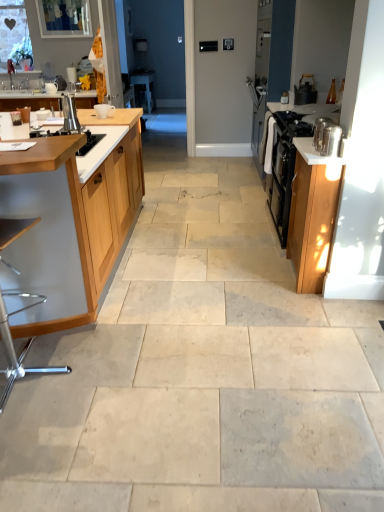
Question: Is white glossy table at center taller than metallic silver containers at right?

Choices:
 (A) yes
 (B) no

Answer: (A)

Question: Is white glossy table at center closer to camera compared to metallic silver containers at right?

Choices:
 (A) yes
 (B) no

Answer: (B)

Question: From a real-world perspective, is white glossy table at center located beneath metallic silver containers at right?

Choices:
 (A) yes
 (B) no

Answer: (A)

Question: Does white glossy table at center contain metallic silver containers at right?

Choices:
 (A) no
 (B) yes

Answer: (A)

Question: Is white glossy table at center beside metallic silver containers at right?

Choices:
 (A) no
 (B) yes

Answer: (A)

Question: From a real-world perspective, relative to wooden cabinet at left, which appears as the 1th cabinetry when viewed from the left, is matte silver sink at left vertically above or below?

Choices:
 (A) above
 (B) below

Answer: (A)

Question: In terms of size, does matte silver sink at left appear bigger or smaller than wooden cabinet at left, the second cabinetry viewed from the right?

Choices:
 (A) big
 (B) small

Answer: (B)

Question: From the image's perspective, is matte silver sink at left positioned above or below wooden cabinet at left, the second cabinetry viewed from the right?

Choices:
 (A) above
 (B) below

Answer: (A)

Question: Considering their positions, is matte silver sink at left located in front of or behind wooden cabinet at left, the second cabinetry viewed from the right?

Choices:
 (A) front
 (B) behind

Answer: (B)

Question: Is metallic silver canister at right, acting as the 1th appliance starting from the front, wider or thinner than matte silver sink at left?

Choices:
 (A) wide
 (B) thin

Answer: (B)

Question: Is point (327, 117) positioned closer to the camera than point (29, 70)?

Choices:
 (A) closer
 (B) farther

Answer: (A)

Question: Is metallic silver canister at right, which is counted as the first appliance, starting from the right, situated inside matte silver sink at left or outside?

Choices:
 (A) outside
 (B) inside

Answer: (A)

Question: Visually, is metallic silver canister at right, marked as the second appliance in a top-to-bottom arrangement, positioned to the left or to the right of matte silver sink at left?

Choices:
 (A) left
 (B) right

Answer: (B)

Question: In terms of height, does wooden cabinet at left, the second cabinetry viewed from the right, look taller or shorter compared to beige stone floor at center?

Choices:
 (A) tall
 (B) short

Answer: (A)

Question: Considering the positions of wooden cabinet at left, the second cabinetry viewed from the right, and beige stone floor at center in the image, is wooden cabinet at left, the second cabinetry viewed from the right, bigger or smaller than beige stone floor at center?

Choices:
 (A) big
 (B) small

Answer: (A)